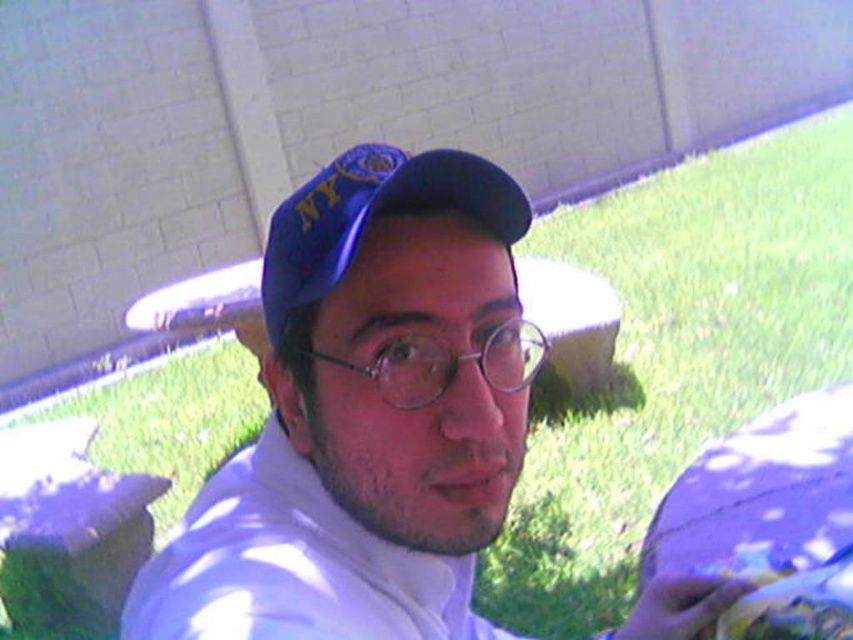
You are a photographer adjusting the camera settings to focus on the subject in the scene. Since the white matte shirt at center and the blue fabric cap at center are both in the frame, which object should you prioritize focusing on if you want to ensure the taller object is sharp?

The white matte shirt at center is taller than the blue fabric cap at center, so you should prioritize focusing on the white matte shirt at center to ensure the taller object is sharp.

You are a photographer trying to capture the person in the scene. The point at coordinates (366, 417) is part of an object in the image. Which object is it located on?

The point at coordinates (366, 417) is located on the white matte shirt at center.

You are a photographer trying to capture the person in the scene. You need to adjust your camera to focus on the white matte shirt at center and the blue fabric cap at center. Based on their positions, which object should you focus on first if you want to start from the left side of the scene?

The blue fabric cap at center should be focused on first because it is positioned to the left of the white matte shirt at center.